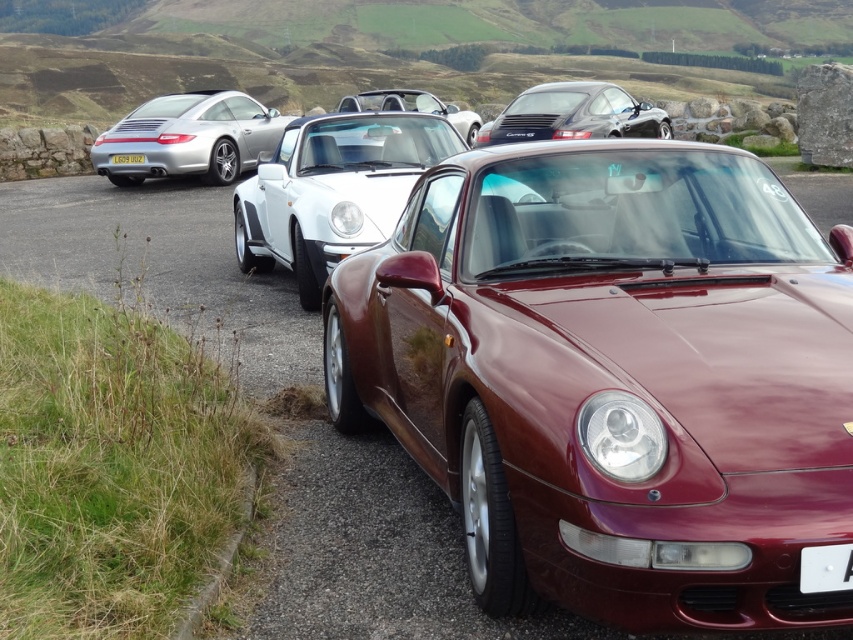
Question: Which point is farther from the camera taking this photo?

Choices:
 (A) (650, 122)
 (B) (688, 564)
 (C) (281, 120)
 (D) (838, 566)

Answer: (C)

Question: Is white plastic license plate at lower right further to camera compared to yellow metallic license plate at center?

Choices:
 (A) no
 (B) yes

Answer: (A)

Question: Is satin white convertible at center further to the viewer compared to satin silver car at left?

Choices:
 (A) yes
 (B) no

Answer: (B)

Question: Considering the real-world distances, which object is farthest from the maroon metallic car at center?

Choices:
 (A) satin black porsche at center
 (B) satin silver car at left
 (C) white plastic license plate at lower right

Answer: (B)

Question: Which object is positioned closest to the white plastic license plate at lower right?

Choices:
 (A) satin silver car at left
 (B) satin black porsche at center
 (C) satin white convertible at center

Answer: (C)

Question: Does maroon metallic car at center lie in front of satin silver car at left?

Choices:
 (A) yes
 (B) no

Answer: (A)